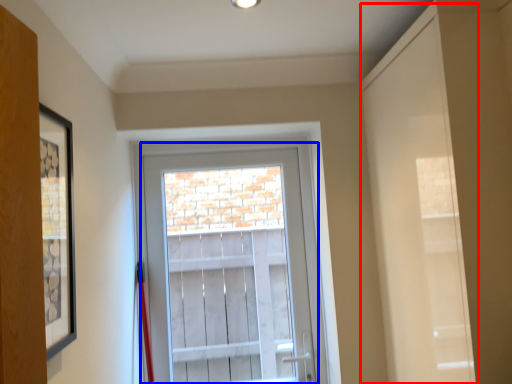
Question: Which object is closer to the camera taking this photo, door (highlighted by a red box) or glass door (highlighted by a blue box)?

Choices:
 (A) door
 (B) glass door

Answer: (A)